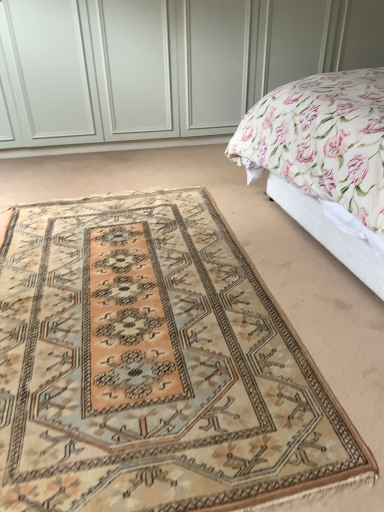
Identify the location of vacant region above beige wool rug at center (from a real-world perspective). The height and width of the screenshot is (512, 384). (147, 306).